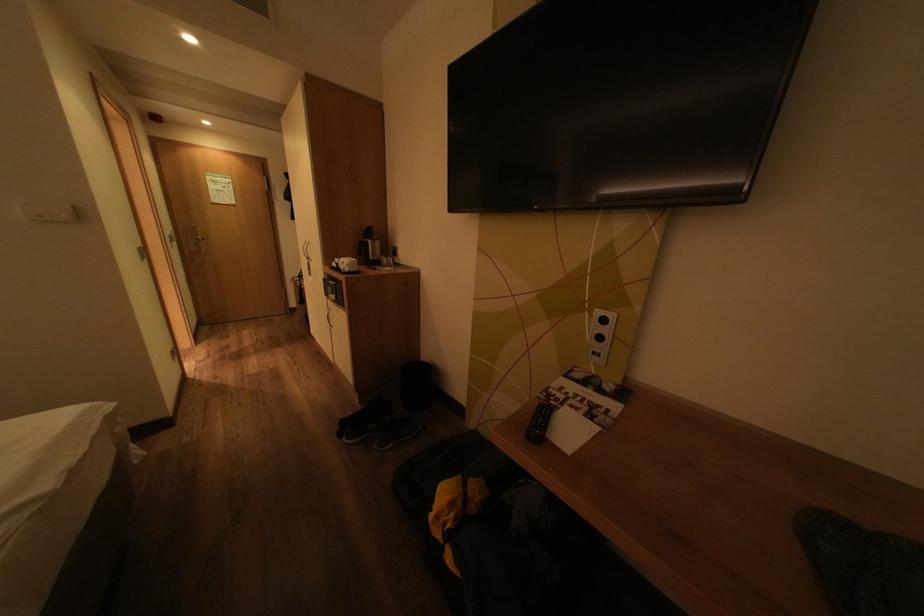
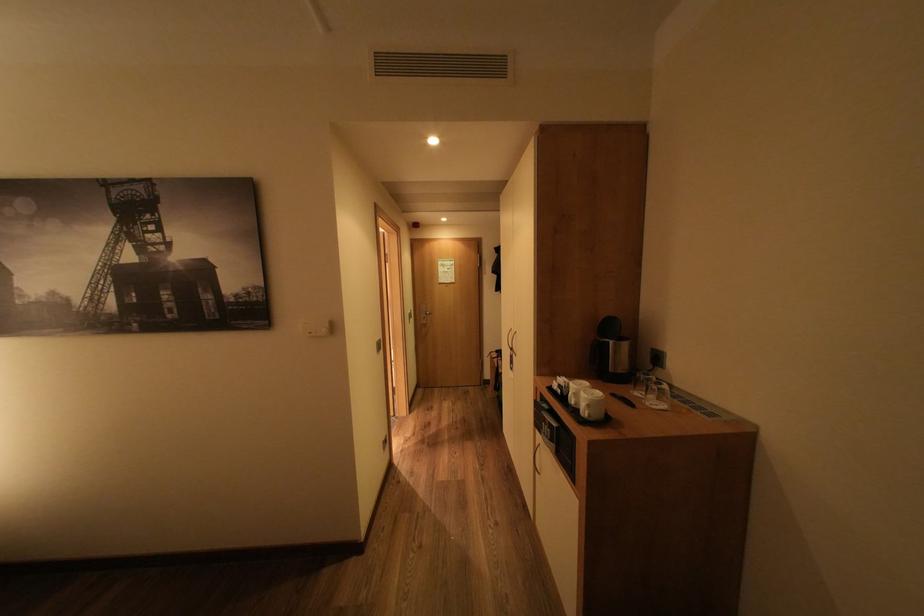
Where in the second image is the point corresponding to (358,265) from the first image?

(600, 406)